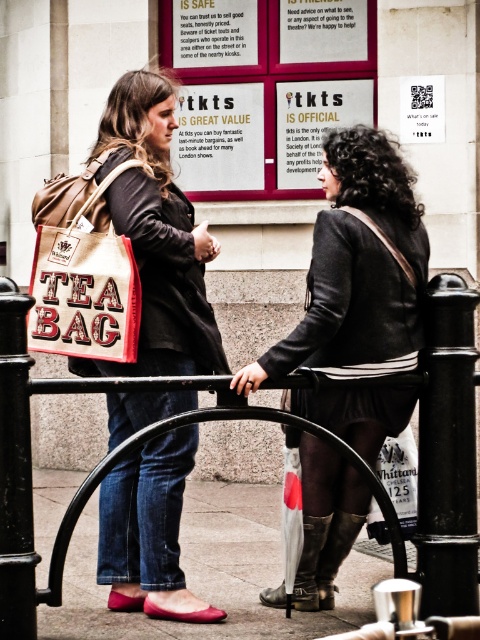
Can you confirm if black metal pole at right is positioned to the right of beige canvas tea bag at center?

Yes, black metal pole at right is to the right of beige canvas tea bag at center.

Where is `black metal pole at right`? The image size is (480, 640). black metal pole at right is located at coordinates (447, 451).

In the scene shown: Between black metal pole at right and leather boot at lower center, which one has less height?

With less height is leather boot at lower center.

Can you confirm if black metal pole at right is wider than leather boot at lower center?

No.

Find the location of a particular element. black metal pole at right is located at coordinates (447, 451).

Find the location of `black metal pole at right`. black metal pole at right is located at coordinates (447, 451).

Who is more forward, (x=64, y=548) or (x=309, y=586)?

Point (x=64, y=548) is more forward.

Does black metal rail at center lie in front of leather boot at lower center?

Yes.

Identify the location of black metal rail at center. (96, 465).